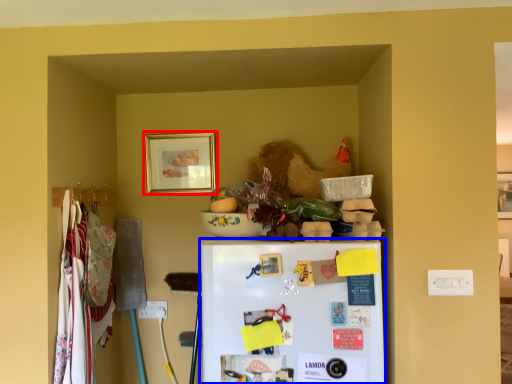
Question: Which object appears closest to the camera in this image, picture frame (highlighted by a red box) or refrigerator (highlighted by a blue box)?

Choices:
 (A) picture frame
 (B) refrigerator

Answer: (B)